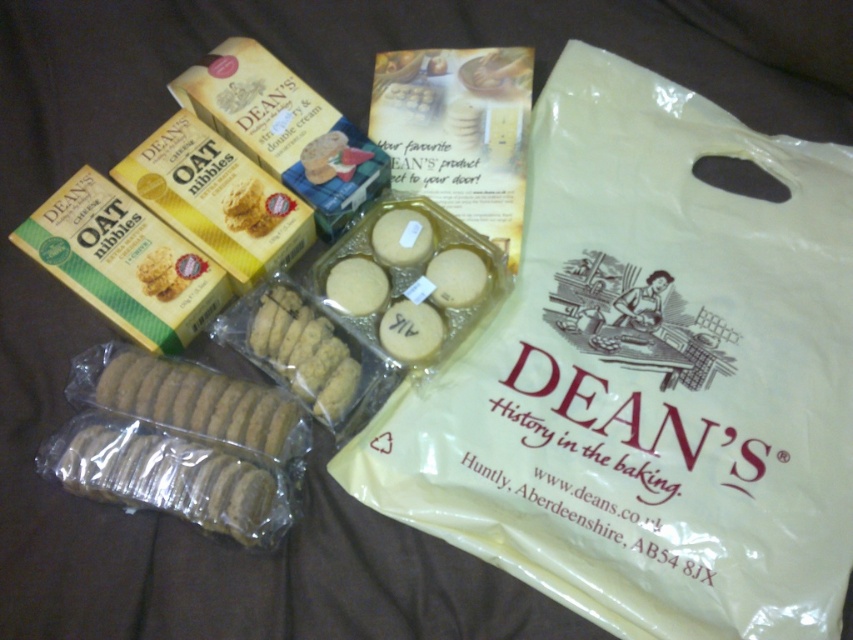
What is located at point (648, 378)?

A beige plastic bag at upper right is located at point (648, 378).